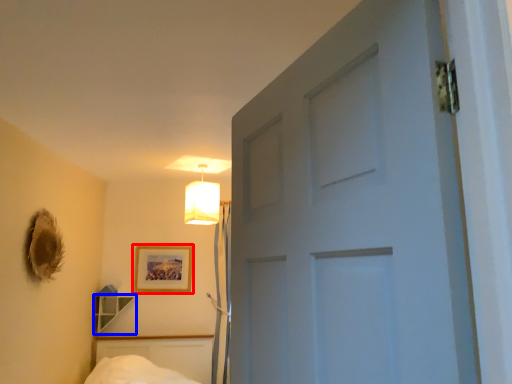
Question: Which of the following is the farthest to the observer, picture frame (highlighted by a red box) or shelf (highlighted by a blue box)?

Choices:
 (A) picture frame
 (B) shelf

Answer: (A)